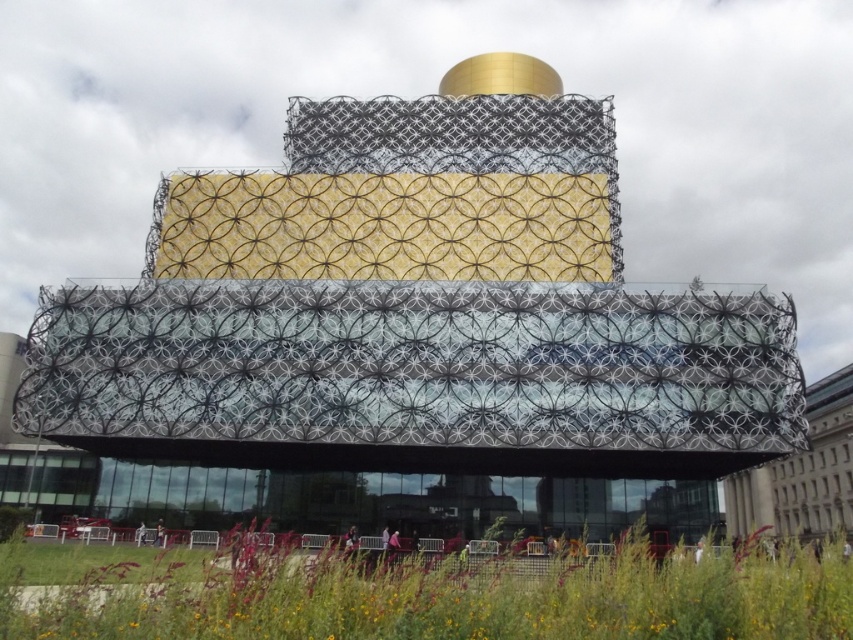
From the picture: You are standing at the base of the modern architectural structure and want to take a photo of the translucent glass facade at center. If your camera has a maximum zoom range of 50 meters, will you be able to capture the entire facade clearly without moving closer?

The translucent glass facade at center is 53.50 meters away from the viewer. Since the camera can only zoom up to 50 meters, you will not be able to capture the entire facade clearly without moving closer.

You are standing in front of the modern architectural structure described. You notice a point at coordinates (415, 365). Based on the scene, what does this point likely represent?

The point at coordinates (415, 365) corresponds to the translucent glass facade at center.

You are standing in front of the modern architectural structure and want to take a photo of both the translucent glass facade at center and the green grass at lower center. Based on their positions, which object should you adjust your camera to focus on first to ensure both are in the frame?

The translucent glass facade at center is positioned on the right side of green grass at lower center, so you should focus on the green grass at lower center first to ensure both are in the frame.